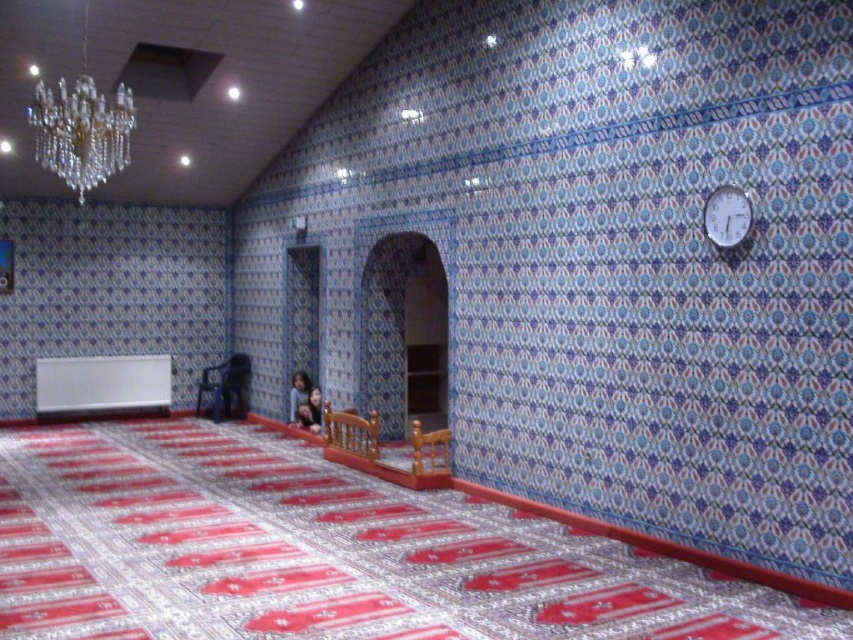
You are standing in the mosque and want to place a new decorative item between the crystal glass chandelier at upper left and the metallic blue chair at center. Based on their positions, which object should the item be closer to?

The crystal glass chandelier at upper left is positioned on the right side of the metallic blue chair at center, so the new decorative item should be placed closer to the metallic blue chair at center to maintain symmetry between the two objects.

You are standing in the mosque and want to check the time using the white plastic clock at upper right. However, there is a crystal glass chandelier at upper left blocking your view. Can you move closer to see the time clearly?

The crystal glass chandelier at upper left is further to the viewer than the white plastic clock at upper right, so moving closer would bring the white plastic clock at upper right into a clearer view by reducing the obstruction from the chandelier.